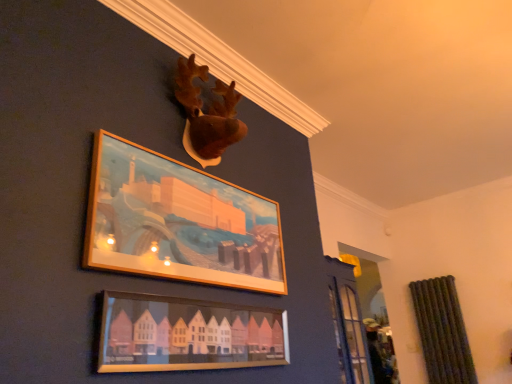
Question: In which direction should I rotate to look at wooden frame at upper center, acting as the first picture frame starting from the top?

Choices:
 (A) right
 (B) left

Answer: (B)

Question: Does matte wooden picture frame at lower center, which appears as the 2th picture frame when viewed from the top, have a lesser height compared to wooden frame at upper center, the 2th picture frame ordered from the bottom?

Choices:
 (A) yes
 (B) no

Answer: (A)

Question: From the image's perspective, would you say matte wooden picture frame at lower center, which ranks as the first picture frame in bottom-to-top order, is shown under wooden frame at upper center, the 2th picture frame ordered from the bottom?

Choices:
 (A) yes
 (B) no

Answer: (A)

Question: Can you confirm if matte wooden picture frame at lower center, which ranks as the first picture frame in bottom-to-top order, is thinner than wooden frame at upper center, the 2th picture frame ordered from the bottom?

Choices:
 (A) no
 (B) yes

Answer: (B)

Question: Does matte wooden picture frame at lower center, which ranks as the first picture frame in bottom-to-top order, appear on the left side of wooden frame at upper center, acting as the first picture frame starting from the top?

Choices:
 (A) yes
 (B) no

Answer: (B)

Question: Can you confirm if matte wooden picture frame at lower center, which ranks as the first picture frame in bottom-to-top order, is bigger than wooden frame at upper center, the 2th picture frame ordered from the bottom?

Choices:
 (A) no
 (B) yes

Answer: (A)

Question: Is matte wooden picture frame at lower center, which ranks as the first picture frame in bottom-to-top order, smaller than wooden frame at upper center, the 2th picture frame ordered from the bottom?

Choices:
 (A) yes
 (B) no

Answer: (A)

Question: Is brown plush moose head at upper center at the back of matte wooden picture frame at lower center, which ranks as the first picture frame in bottom-to-top order?

Choices:
 (A) no
 (B) yes

Answer: (A)

Question: From the image's perspective, is matte wooden picture frame at lower center, which appears as the 2th picture frame when viewed from the top, over brown plush moose head at upper center?

Choices:
 (A) no
 (B) yes

Answer: (A)

Question: Does matte wooden picture frame at lower center, which appears as the 2th picture frame when viewed from the top, have a greater width compared to brown plush moose head at upper center?

Choices:
 (A) yes
 (B) no

Answer: (B)

Question: Considering the relative sizes of matte wooden picture frame at lower center, which appears as the 2th picture frame when viewed from the top, and brown plush moose head at upper center in the image provided, is matte wooden picture frame at lower center, which appears as the 2th picture frame when viewed from the top, smaller than brown plush moose head at upper center?

Choices:
 (A) yes
 (B) no

Answer: (A)

Question: Is matte wooden picture frame at lower center, which appears as the 2th picture frame when viewed from the top, next to brown plush moose head at upper center?

Choices:
 (A) no
 (B) yes

Answer: (A)

Question: Considering the relative sizes of matte wooden picture frame at lower center, which ranks as the first picture frame in bottom-to-top order, and brown plush moose head at upper center in the image provided, is matte wooden picture frame at lower center, which ranks as the first picture frame in bottom-to-top order, bigger than brown plush moose head at upper center?

Choices:
 (A) yes
 (B) no

Answer: (B)

Question: Considering the relative positions of wooden frame at upper center, the 2th picture frame ordered from the bottom, and matte wooden picture frame at lower center, which appears as the 2th picture frame when viewed from the top, in the image provided, is wooden frame at upper center, the 2th picture frame ordered from the bottom, in front of matte wooden picture frame at lower center, which appears as the 2th picture frame when viewed from the top,?

Choices:
 (A) no
 (B) yes

Answer: (A)